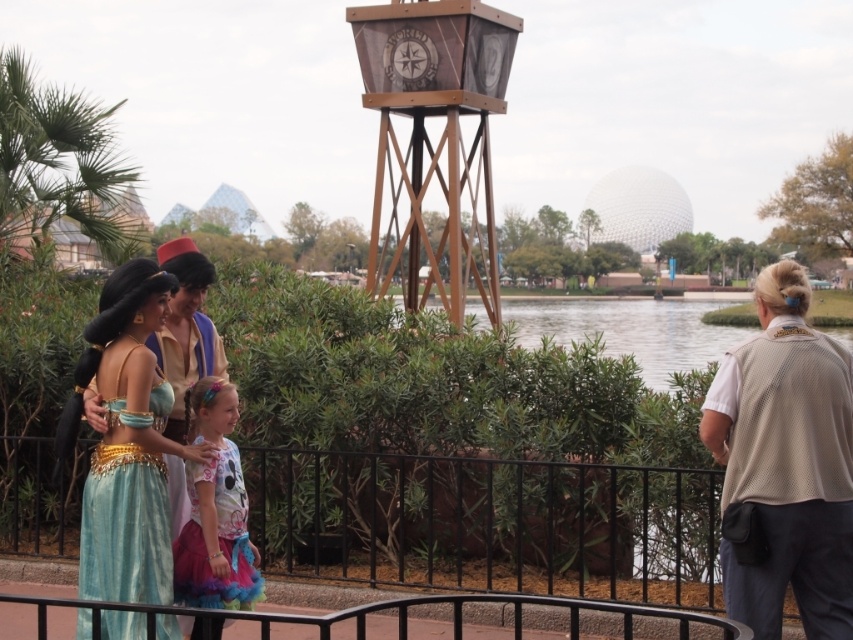
What do you see at coordinates (126, 509) in the screenshot? The height and width of the screenshot is (640, 853). I see `teal velvet dress at left` at bounding box center [126, 509].

Which is more to the right, teal velvet dress at left or pastel floral dress at center?

Positioned to the right is pastel floral dress at center.

This screenshot has width=853, height=640. In order to click on teal velvet dress at left in this screenshot , I will do `click(126, 509)`.

Who is more distant from viewer, [814,460] or [405,621]?

The point [814,460] is more distant.

What do you see at coordinates (784, 465) in the screenshot? Image resolution: width=853 pixels, height=640 pixels. I see `beige mesh vest at right` at bounding box center [784, 465].

Is point (770, 419) positioned in front of point (659, 618)?

Yes, point (770, 419) is in front of point (659, 618).

The height and width of the screenshot is (640, 853). Find the location of `beige mesh vest at right`. beige mesh vest at right is located at coordinates (784, 465).

Can you confirm if black metal fence at lower center is positioned above metallic silver railing at center?

Actually, black metal fence at lower center is below metallic silver railing at center.

How distant is black metal fence at lower center from metallic silver railing at center?

A distance of 4.07 meters exists between black metal fence at lower center and metallic silver railing at center.

In order to click on black metal fence at lower center in this screenshot , I will do `click(489, 524)`.

This screenshot has height=640, width=853. I want to click on black metal fence at lower center, so click(489, 524).